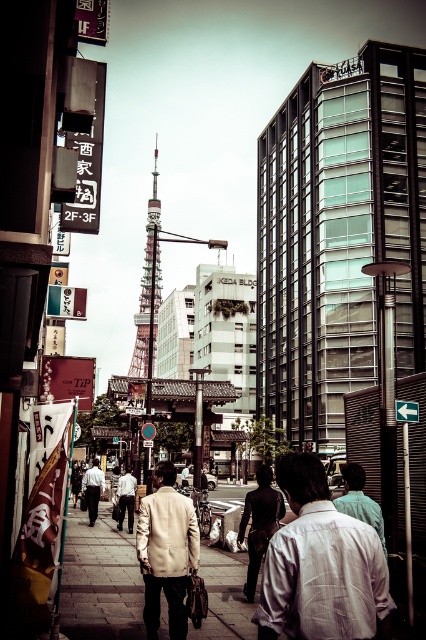
Question: Where is beige fabric jacket at center located in relation to light beige jacket at center in the image?

Choices:
 (A) above
 (B) below

Answer: (A)

Question: Which point is closer to the camera?

Choices:
 (A) pyautogui.click(x=385, y=637)
 (B) pyautogui.click(x=95, y=513)
 (C) pyautogui.click(x=175, y=634)
 (D) pyautogui.click(x=127, y=477)

Answer: (A)

Question: Does beige fabric jacket at center appear under light beige jacket at center?

Choices:
 (A) no
 (B) yes

Answer: (A)

Question: Considering the real-world distances, which object is closest to the light beige jacket at center?

Choices:
 (A) beige fabric jacket at center
 (B) light beige suit at center
 (C) white textured shirt at center

Answer: (B)

Question: Is beige fabric jacket at center wider than light beige jacket at center?

Choices:
 (A) no
 (B) yes

Answer: (A)

Question: Among these points, which one is nearest to the camera?

Choices:
 (A) (192, 636)
 (B) (118, 488)
 (C) (357, 593)
 (D) (198, 547)

Answer: (C)